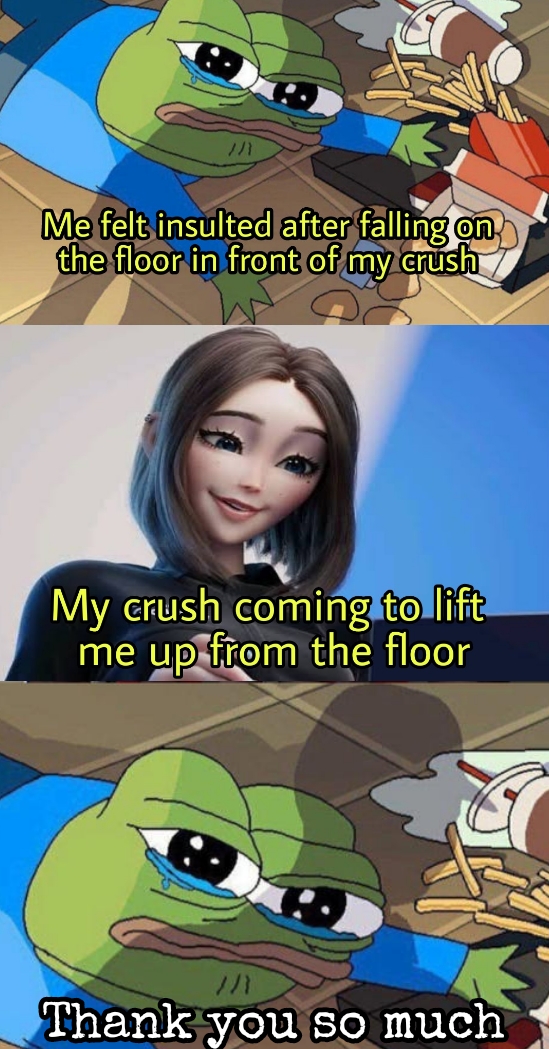
Find the location of `spilt drink`. spilt drink is located at coordinates (462, 35), (525, 816).